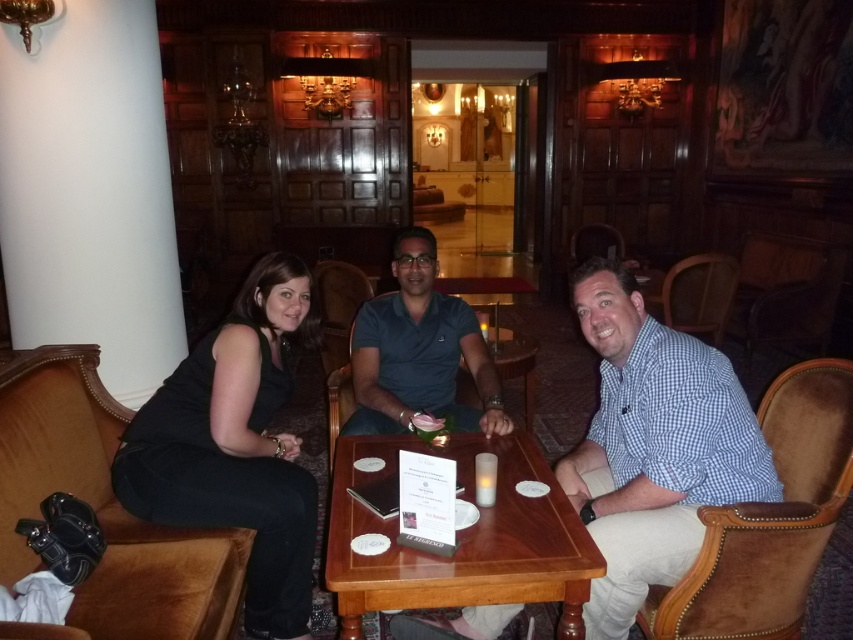
Question: Which of the following is the closest to the observer?

Choices:
 (A) (397, 387)
 (B) (140, 449)
 (C) (489, 499)
 (D) (341, 536)

Answer: (D)

Question: Can you confirm if blue checkered shirt at center is thinner than wooden table at center?

Choices:
 (A) no
 (B) yes

Answer: (B)

Question: Which object is the closest to the wooden table at center?

Choices:
 (A) white frosted glass at table center
 (B) blue checkered shirt at center
 (C) blue cotton polo shirt at center

Answer: (A)

Question: Does blue checkered shirt at center have a smaller size compared to blue cotton polo shirt at center?

Choices:
 (A) no
 (B) yes

Answer: (A)

Question: Which object appears closest to the camera in this image?

Choices:
 (A) blue checkered shirt at center
 (B) white frosted glass at table center
 (C) black fabric dress at left

Answer: (A)

Question: Is the position of blue cotton polo shirt at center more distant than that of white frosted glass at table center?

Choices:
 (A) yes
 (B) no

Answer: (A)